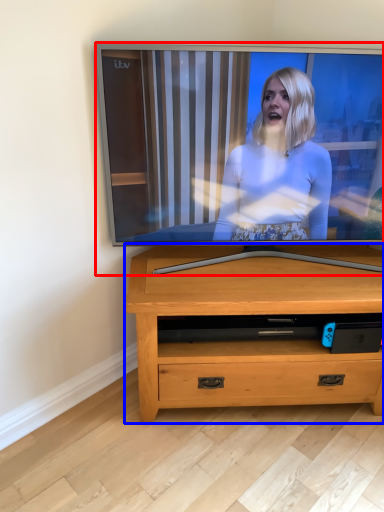
Question: Which point is closer to the camera, television (highlighted by a red box) or chest of drawers (highlighted by a blue box)?

Choices:
 (A) television
 (B) chest of drawers

Answer: (A)